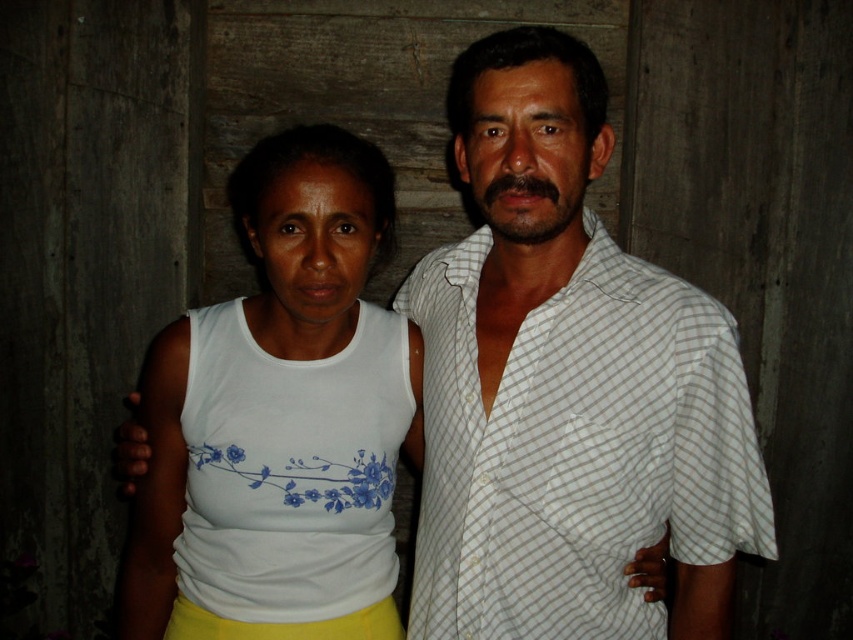
You are trying to decide which clothing item to take from the image. Both the white cotton shirt at center and the white fabric tank top at center are visible. Which one is more accessible to reach?

The white cotton shirt at center is more accessible to reach because it is in front of the white fabric tank top at center.

You are a photographer trying to capture a group photo. You have two subjects wearing the white cotton shirt at center and the white checkered shirt at right. If you want to ensure both shirts are visible in the frame, which shirt should you focus on adjusting the camera angle for, considering their widths?

The white cotton shirt at center is wider than the white checkered shirt at right. To ensure both shirts are visible, focus on adjusting the camera angle to accommodate the wider white cotton shirt at center.

Based on the photo, you are a photographer standing at the camera position. You want to adjust the focus so that both the white cotton shirt at center and the camera are in focus. What is the minimum distance you should set the focus range to?

The white cotton shirt at center and camera are 1.00 meters apart, so the minimum focus range should be set to at least 1.00 meters to ensure both are in focus.